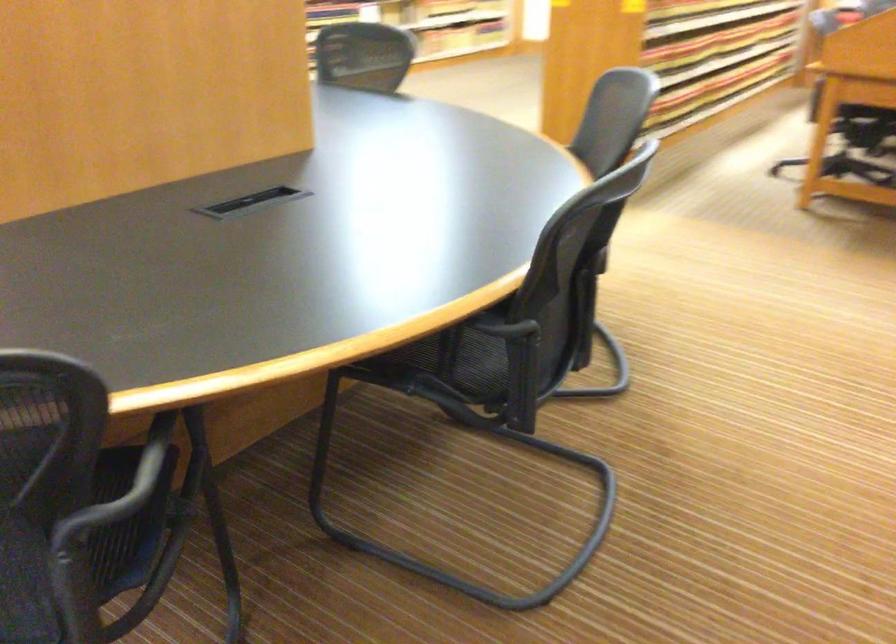
The height and width of the screenshot is (644, 896). I want to click on chair armrest, so click(x=151, y=460).